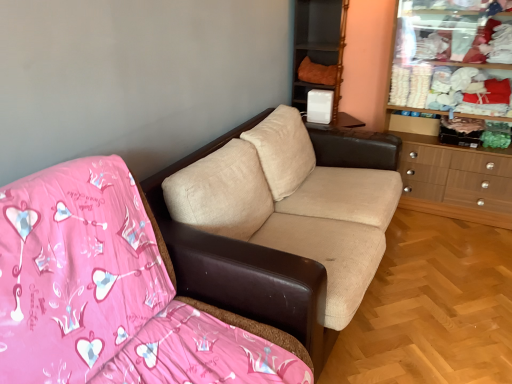
How much space does beige fabric couch at center, which is counted as the 1th studio couch, starting from the back, occupy horizontally?

5.22 feet.

Where is `wooden dresser at right`? wooden dresser at right is located at coordinates (459, 186).

What do you see at coordinates (459, 186) in the screenshot? This screenshot has width=512, height=384. I see `wooden dresser at right` at bounding box center [459, 186].

Identify the location of beige fabric couch at center, which is counted as the 1th studio couch, starting from the back. This screenshot has width=512, height=384. (243, 268).

Could you tell me if orange fabric cushion at upper center is turned towards beige fabric couch at center, arranged as the 2th studio couch when viewed from the back?

Yes, orange fabric cushion at upper center is facing beige fabric couch at center, arranged as the 2th studio couch when viewed from the back.

Who is shorter, orange fabric cushion at upper center or beige fabric couch at center, the first studio couch when ordered from front to back?

orange fabric cushion at upper center.

Considering the points (330, 80) and (284, 368), which point is behind, point (330, 80) or point (284, 368)?

The point (330, 80) is more distant.

How far apart are beige fabric couch at center, which is the second studio couch from front to back, and beige fabric couch at center, arranged as the 2th studio couch when viewed from the back?

beige fabric couch at center, which is the second studio couch from front to back, is 33.29 centimeters from beige fabric couch at center, arranged as the 2th studio couch when viewed from the back.

Considering the relative sizes of beige fabric couch at center, which is the second studio couch from front to back, and beige fabric couch at center, arranged as the 2th studio couch when viewed from the back, in the image provided, is beige fabric couch at center, which is the second studio couch from front to back, shorter than beige fabric couch at center, arranged as the 2th studio couch when viewed from the back,?

Correct, beige fabric couch at center, which is the second studio couch from front to back, is not as tall as beige fabric couch at center, arranged as the 2th studio couch when viewed from the back.

Visually, is beige fabric couch at center, which is counted as the 1th studio couch, starting from the back, positioned to the left or to the right of beige fabric couch at center, arranged as the 2th studio couch when viewed from the back?

beige fabric couch at center, which is counted as the 1th studio couch, starting from the back, is positioned on beige fabric couch at center, arranged as the 2th studio couch when viewed from the back,'s right side.

Between beige fabric couch at center, which is counted as the 1th studio couch, starting from the back, and beige fabric couch at center, arranged as the 2th studio couch when viewed from the back, which one has smaller size?

Smaller between the two is beige fabric couch at center, which is counted as the 1th studio couch, starting from the back.

Would you say wooden dresser at right contains beige fabric couch at center, which is counted as the 1th studio couch, starting from the back?

No, beige fabric couch at center, which is counted as the 1th studio couch, starting from the back, is not surrounded by wooden dresser at right.

Based on the photo, which of these two, wooden dresser at right or beige fabric couch at center, which is counted as the 1th studio couch, starting from the back, is bigger?

wooden dresser at right.

Considering the relative positions of wooden dresser at right and beige fabric couch at center, which is counted as the 1th studio couch, starting from the back, in the image provided, is wooden dresser at right in front of beige fabric couch at center, which is counted as the 1th studio couch, starting from the back,?

No.

Is wooden dresser at right not close to beige fabric couch at center, which is the second studio couch from front to back?

wooden dresser at right is positioned a significant distance from beige fabric couch at center, which is the second studio couch from front to back.

Does wooden dresser at right have a smaller size compared to beige fabric couch at center, the first studio couch when ordered from front to back?

Yes, wooden dresser at right is smaller than beige fabric couch at center, the first studio couch when ordered from front to back.

Does point (462, 31) appear closer or farther from the camera than point (158, 248)?

Point (462, 31) is farther from the camera than point (158, 248).

Based on their positions, is wooden dresser at right located to the left or right of beige fabric couch at center, the first studio couch when ordered from front to back?

Clearly, wooden dresser at right is on the right of beige fabric couch at center, the first studio couch when ordered from front to back, in the image.

From a real-world perspective, is wooden dresser at right physically located above or below beige fabric couch at center, the first studio couch when ordered from front to back?

From a real-world perspective, wooden dresser at right is physically above beige fabric couch at center, the first studio couch when ordered from front to back.

The image size is (512, 384). In order to click on dresser on the right of beige fabric couch at center, which is counted as the 1th studio couch, starting from the back in this screenshot , I will do `click(459, 186)`.

From a real-world perspective, is beige fabric couch at center, which is the second studio couch from front to back, positioned over wooden dresser at right based on gravity?

No, from a real-world perspective, beige fabric couch at center, which is the second studio couch from front to back, is not on top of wooden dresser at right.

Which is in front, point (316, 67) or point (206, 301)?

The point (206, 301) is in front.

From the image's perspective, would you say orange fabric cushion at upper center is shown under beige fabric couch at center, which is the second studio couch from front to back?

No, from the image's perspective, orange fabric cushion at upper center is not beneath beige fabric couch at center, which is the second studio couch from front to back.

From a real-world perspective, is orange fabric cushion at upper center above or below beige fabric couch at center, which is counted as the 1th studio couch, starting from the back?

orange fabric cushion at upper center is above beige fabric couch at center, which is counted as the 1th studio couch, starting from the back.

Between orange fabric cushion at upper center and beige fabric couch at center, which is the second studio couch from front to back, which one has larger size?

Bigger between the two is beige fabric couch at center, which is the second studio couch from front to back.

What's the angular difference between beige fabric couch at center, which is the second studio couch from front to back, and orange fabric cushion at upper center's facing directions?

There is a 88.8-degree angle between the facing directions of beige fabric couch at center, which is the second studio couch from front to back, and orange fabric cushion at upper center.

From the picture: Is beige fabric couch at center, which is counted as the 1th studio couch, starting from the back, facing away from orange fabric cushion at upper center?

That's not correct — beige fabric couch at center, which is counted as the 1th studio couch, starting from the back, is not looking away from orange fabric cushion at upper center.

Who is taller, beige fabric couch at center, which is counted as the 1th studio couch, starting from the back, or orange fabric cushion at upper center?

Standing taller between the two is orange fabric cushion at upper center.

From the image's perspective, which is below, beige fabric couch at center, which is the second studio couch from front to back, or orange fabric cushion at upper center?

beige fabric couch at center, which is the second studio couch from front to back, from the image's perspective.

Identify the location of clothing on the right of beige fabric couch at center, the first studio couch when ordered from front to back. (317, 72).

You are a GUI agent. You are given a task and a screenshot of the screen. Output one action in this format:
    pyautogui.click(x=<x>, y=<y>)
    Task: Click on the studio couch that appears behind the beige fabric couch at center, the first studio couch when ordered from front to back
    The width and height of the screenshot is (512, 384).
    Given the screenshot: What is the action you would take?
    pyautogui.click(x=243, y=268)

Considering their positions, is orange fabric cushion at upper center positioned further to beige fabric couch at center, which is counted as the 1th studio couch, starting from the back, than wooden dresser at right?

The object further to beige fabric couch at center, which is counted as the 1th studio couch, starting from the back, is orange fabric cushion at upper center.

Looking at the image, which one is located closer to wooden dresser at right, orange fabric cushion at upper center or beige fabric couch at center, arranged as the 2th studio couch when viewed from the back?

orange fabric cushion at upper center is positioned closer to the anchor wooden dresser at right.

Looking at the image, which one is located closer to beige fabric couch at center, which is the second studio couch from front to back, wooden dresser at right or orange fabric cushion at upper center?

Based on the image, wooden dresser at right appears to be nearer to beige fabric couch at center, which is the second studio couch from front to back.

Looking at this image, from the image, which object appears to be farther from orange fabric cushion at upper center, beige fabric couch at center, the first studio couch when ordered from front to back, or beige fabric couch at center, which is the second studio couch from front to back?

The object further to orange fabric cushion at upper center is beige fabric couch at center, the first studio couch when ordered from front to back.

Based on their spatial positions, is beige fabric couch at center, arranged as the 2th studio couch when viewed from the back, or wooden dresser at right further from orange fabric cushion at upper center?

beige fabric couch at center, arranged as the 2th studio couch when viewed from the back, is positioned further to the anchor orange fabric cushion at upper center.

Based on their spatial positions, is beige fabric couch at center, which is the second studio couch from front to back, or wooden dresser at right further from orange fabric cushion at upper center?

Based on the image, beige fabric couch at center, which is the second studio couch from front to back, appears to be further to orange fabric cushion at upper center.

Looking at the image, which one is located further to beige fabric couch at center, the first studio couch when ordered from front to back, wooden dresser at right or beige fabric couch at center, which is the second studio couch from front to back?

Based on the image, wooden dresser at right appears to be further to beige fabric couch at center, the first studio couch when ordered from front to back.

Looking at the image, which one is located closer to beige fabric couch at center, arranged as the 2th studio couch when viewed from the back, wooden dresser at right or orange fabric cushion at upper center?

wooden dresser at right is positioned closer to the anchor beige fabric couch at center, arranged as the 2th studio couch when viewed from the back.

Find the location of a particular element. This screenshot has width=512, height=384. studio couch between beige fabric couch at center, the first studio couch when ordered from front to back, and wooden dresser at right, in the horizontal direction is located at coordinates (243, 268).

The width and height of the screenshot is (512, 384). I want to click on dresser between beige fabric couch at center, which is the second studio couch from front to back, and orange fabric cushion at upper center from front to back, so click(x=459, y=186).

Locate an element on the screen. The image size is (512, 384). studio couch located between beige fabric couch at center, the first studio couch when ordered from front to back, and orange fabric cushion at upper center in the depth direction is located at coordinates (243, 268).

The width and height of the screenshot is (512, 384). Identify the location of dresser positioned between beige fabric couch at center, arranged as the 2th studio couch when viewed from the back, and orange fabric cushion at upper center from near to far. (459, 186).